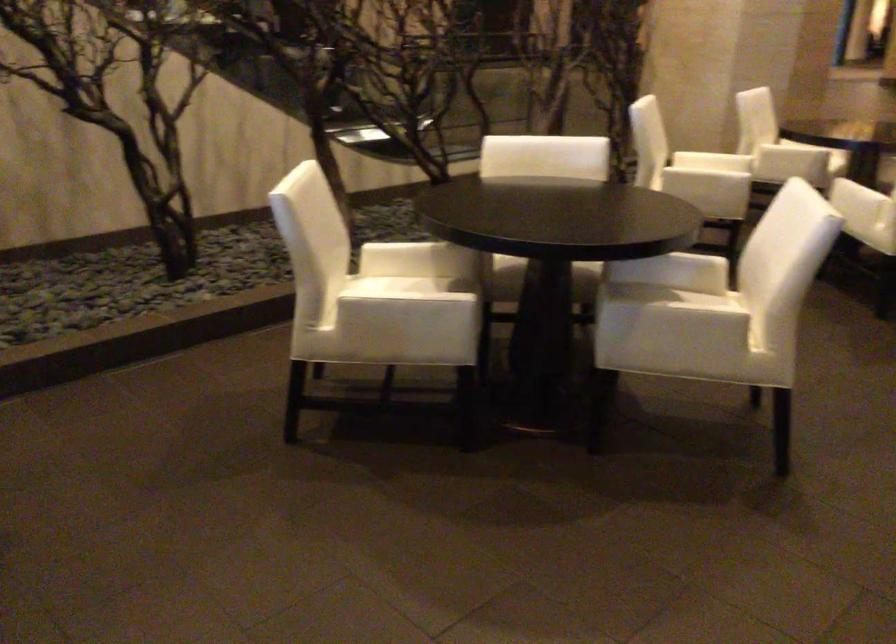
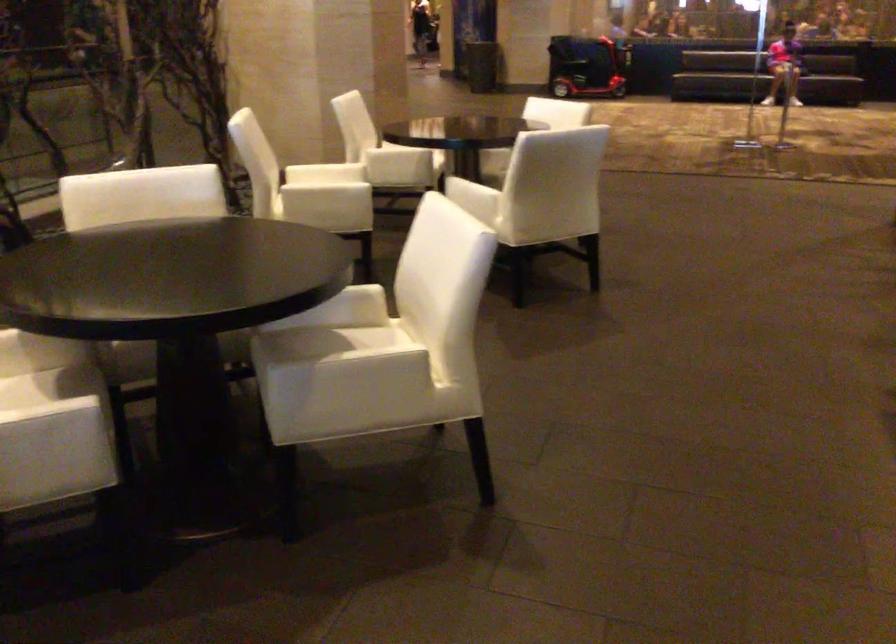
Locate, in the second image, the point that corresponds to [666,290] in the first image.

(324, 339)